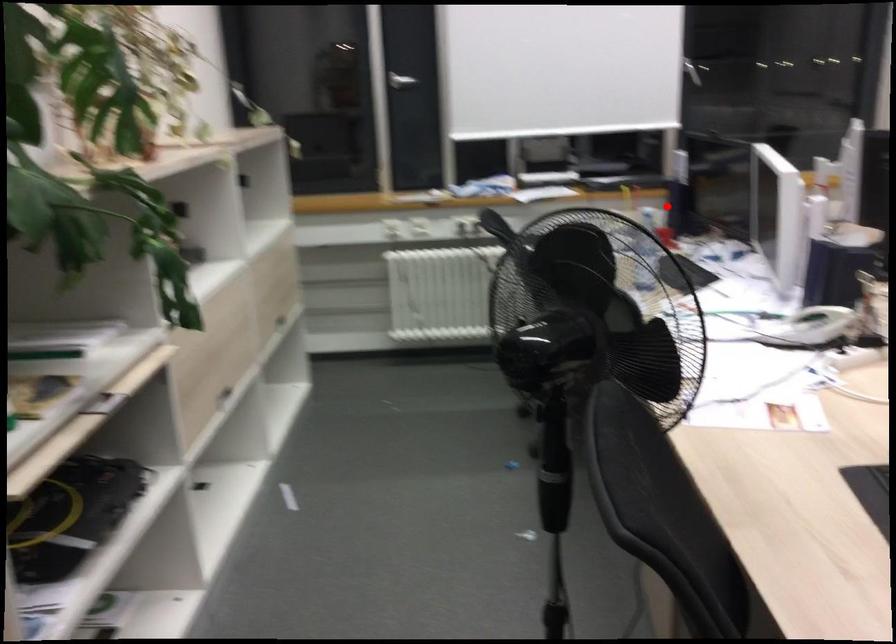
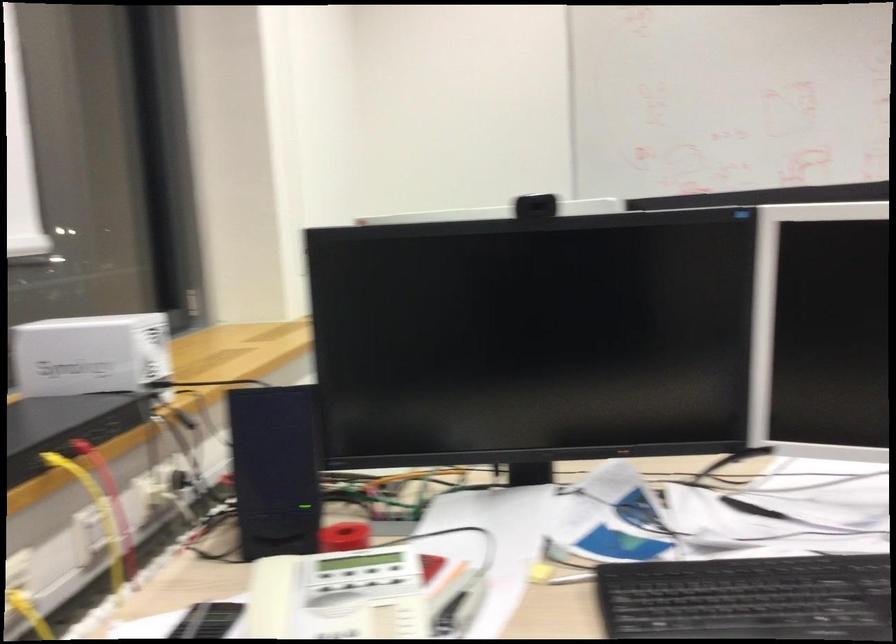
The point at the highlighted location is marked in the first image. Where is the corresponding point in the second image?

(274, 469)